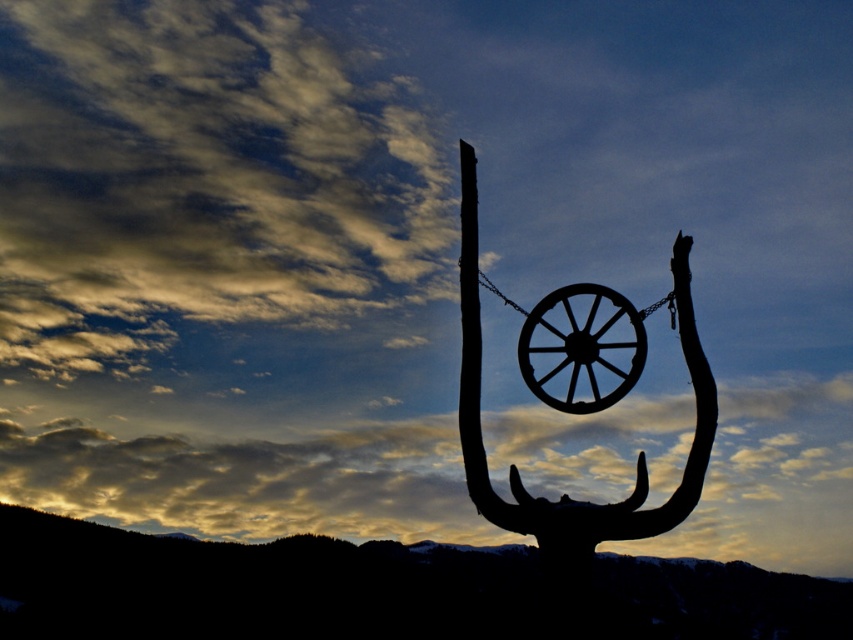
Which is more to the right, silvery metal wagon wheel at center or black matte wheel at center?

From the viewer's perspective, black matte wheel at center appears more on the right side.

Where is `silvery metal wagon wheel at center`? This screenshot has width=853, height=640. silvery metal wagon wheel at center is located at coordinates (566, 496).

Where is `silvery metal wagon wheel at center`? Image resolution: width=853 pixels, height=640 pixels. silvery metal wagon wheel at center is located at coordinates (566, 496).